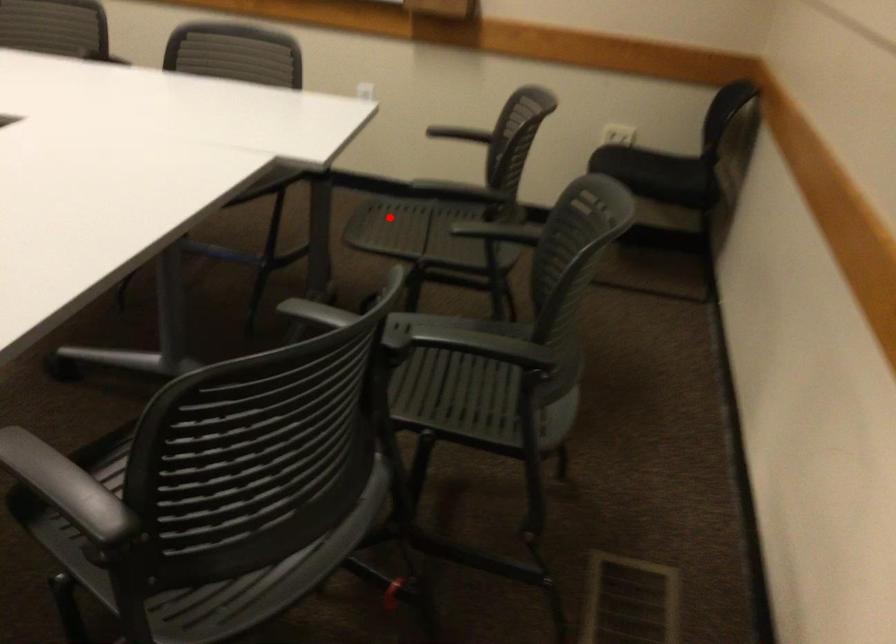
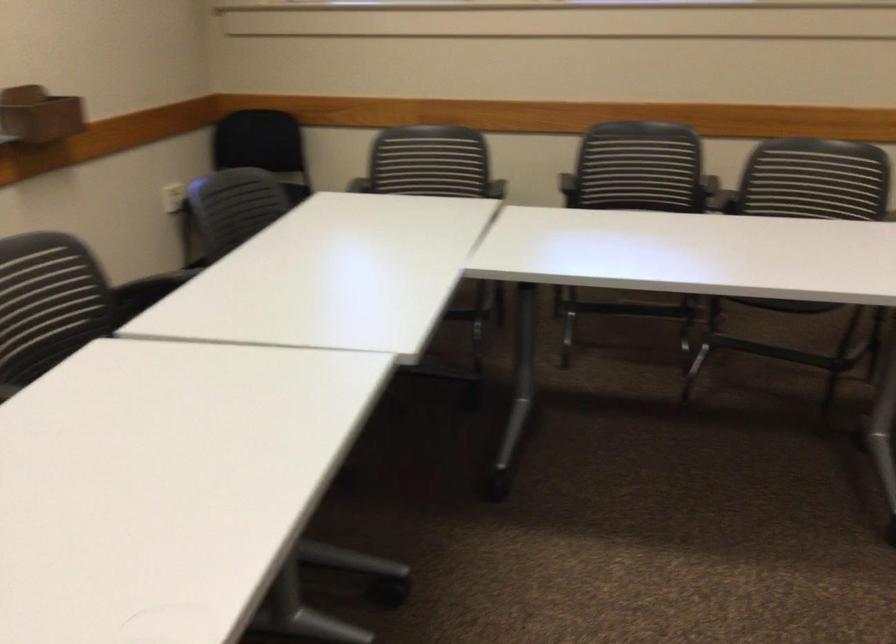
Question: I am providing you with two images of the same scene from different viewpoints. A red point is marked on the first image. At the location where the point appears in image 1, is it still visible in image 2?

Choices:
 (A) Yes
 (B) No

Answer: (B)